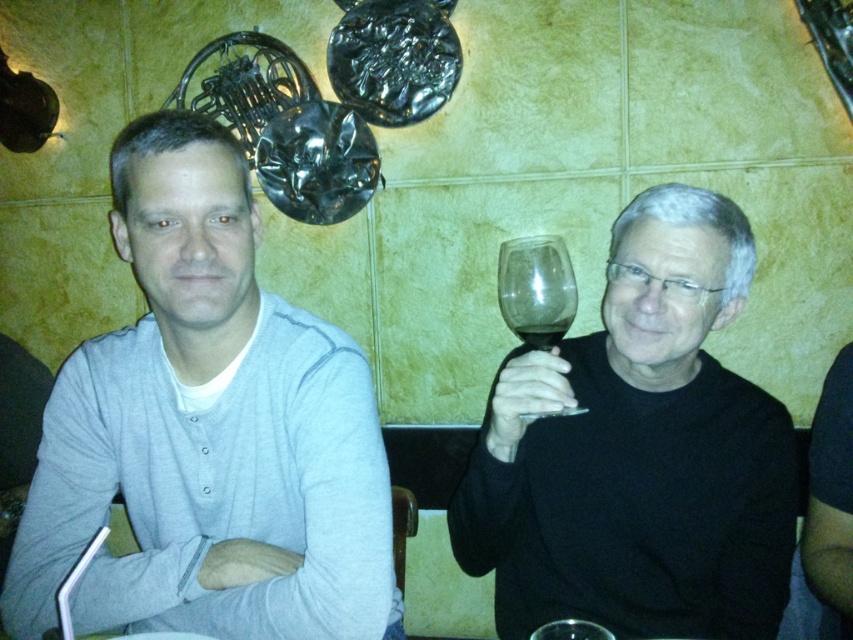
Which of these two, gray cotton shirt at left or transparent glass wine at upper center, stands shorter?

transparent glass wine at upper center is shorter.

Is gray cotton shirt at left taller than transparent glass wine at upper center?

Correct, gray cotton shirt at left is much taller as transparent glass wine at upper center.

Is point (166, 307) farther from camera compared to point (555, 340)?

Yes, it is.

Identify the location of gray cotton shirt at left. The height and width of the screenshot is (640, 853). (207, 433).

Does black matte wine glass at right have a larger size compared to transparent glass wine at upper center?

Yes.

Is black matte wine glass at right above transparent glass wine at upper center?

No, black matte wine glass at right is not above transparent glass wine at upper center.

The width and height of the screenshot is (853, 640). Describe the element at coordinates (637, 451) in the screenshot. I see `black matte wine glass at right` at that location.

Image resolution: width=853 pixels, height=640 pixels. I want to click on black matte wine glass at right, so click(x=637, y=451).

Is transparent glass at right to the right of transparent glass wine at upper center from the viewer's perspective?

Correct, you'll find transparent glass at right to the right of transparent glass wine at upper center.

Does point (529, 337) lie behind point (544, 333)?

Yes, it is behind point (544, 333).

The image size is (853, 640). In order to click on transparent glass at right in this screenshot , I will do pos(537,289).